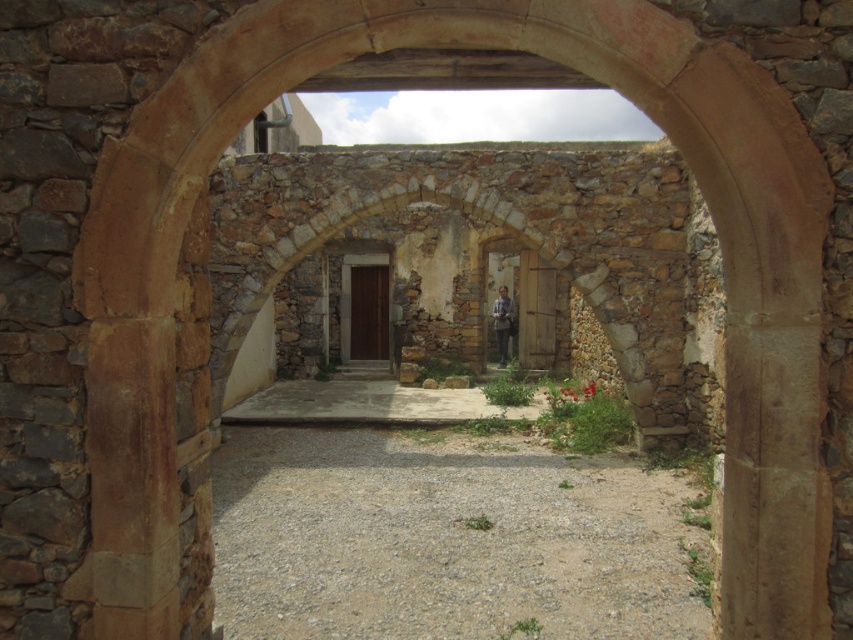
Question: In this image, where is gray gravel at center located relative to smooth concrete path at center?

Choices:
 (A) above
 (B) below

Answer: (B)

Question: Can you confirm if gray gravel at center is positioned above smooth concrete path at center?

Choices:
 (A) yes
 (B) no

Answer: (B)

Question: Which of the following is the closest to the observer?

Choices:
 (A) gray gravel at center
 (B) smooth concrete path at center

Answer: (A)

Question: Among these objects, which one is nearest to the camera?

Choices:
 (A) smooth concrete path at center
 (B) gray gravel at center

Answer: (B)

Question: Does gray gravel at center appear on the left side of smooth concrete path at center?

Choices:
 (A) no
 (B) yes

Answer: (A)